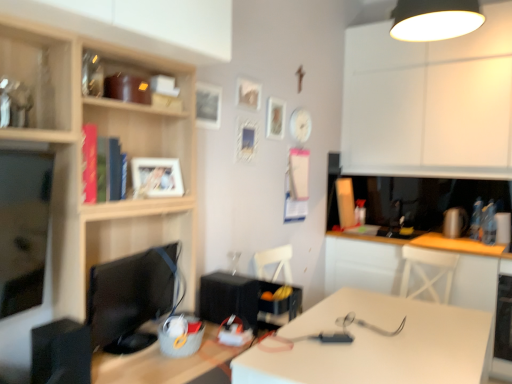
What is the approximate height of white matte desk at center?

white matte desk at center is 25.80 inches tall.

In order to face black glossy monitor at left, should I rotate leftwards or rightwards?

Turn left by 14.703 degrees to look at black glossy monitor at left.

What is the approximate width of matte wooden picture frame at upper left, which ranks as the first picture frame in left-to-right order?

matte wooden picture frame at upper left, which ranks as the first picture frame in left-to-right order, is 4.18 inches wide.

In order to face matte wooden picture frame at upper left, marked as the fifth picture frame in a right-to-left arrangement, should I rotate leftwards or rightwards?

To face it directly, rotate left by 13.085 degrees.

Where is `black plastic speaker at left, the 1th appliance viewed from the left`? Image resolution: width=512 pixels, height=384 pixels. black plastic speaker at left, the 1th appliance viewed from the left is located at coordinates (61, 353).

Measure the distance between wooden photo frame at upper center, the 2th picture frame positioned from the left, and camera.

wooden photo frame at upper center, the 2th picture frame positioned from the left, is 2.18 meters away from camera.

Locate an element on the screen. The width and height of the screenshot is (512, 384). white matte desk at center is located at coordinates (376, 344).

Which of these two, white matte cabinet at upper right, placed as the second cabinetry when sorted from left to right, or black plastic speaker at left, the 1th appliance viewed from the left, is bigger?

With larger size is white matte cabinet at upper right, placed as the second cabinetry when sorted from left to right.

Based on the photo, are white matte cabinet at upper right, marked as the second cabinetry in a front-to-back arrangement, and black plastic speaker at left, which ranks as the second appliance in back-to-front order, located far from each other?

Yes, white matte cabinet at upper right, marked as the second cabinetry in a front-to-back arrangement, is far from black plastic speaker at left, which ranks as the second appliance in back-to-front order.

Starting from the white matte cabinet at upper right, marked as the second cabinetry in a front-to-back arrangement, which appliance is the 2nd one in front? Please provide its 2D coordinates.

[(61, 353)]

From a real-world perspective, which object rests below the other?

black plastic speaker at left, arranged as the first appliance when viewed from the front, is physically lower.

From a real-world perspective, which object rests below the other?

matte wooden picture frame at upper left, marked as the fifth picture frame in a right-to-left arrangement, from a real-world perspective.

Which is less distant, (176, 180) or (259, 88)?

Point (176, 180) is positioned closer to the camera compared to point (259, 88).

Consider the image. Is matte wooden picture frame at upper left, which appears as the first picture frame when viewed from the front, directly adjacent to white matte picture frame at upper center, the 4th picture frame viewed from the left?

matte wooden picture frame at upper left, which appears as the first picture frame when viewed from the front, and white matte picture frame at upper center, the 4th picture frame viewed from the left, are clearly separated.

Considering the relative positions of matte wooden picture frame at upper left, which appears as the first picture frame when viewed from the front, and white matte picture frame at upper center, arranged as the third picture frame when viewed from the front, in the image provided, is matte wooden picture frame at upper left, which appears as the first picture frame when viewed from the front, to the right of white matte picture frame at upper center, arranged as the third picture frame when viewed from the front, from the viewer's perspective?

In fact, matte wooden picture frame at upper left, which appears as the first picture frame when viewed from the front, is to the left of white matte picture frame at upper center, arranged as the third picture frame when viewed from the front.

The width and height of the screenshot is (512, 384). In order to click on cabinetry that appears in front of the white glossy picture frame at upper center, which appears as the 3th picture frame when viewed from the left in this screenshot , I will do `click(81, 167)`.

From a real-world perspective, does white glossy picture frame at upper center, which is the third picture frame from right to left, sit lower than matte wood cabinet at left, which is the 1th cabinetry from front to back?

No, from a real-world perspective, white glossy picture frame at upper center, which is the third picture frame from right to left, is not below matte wood cabinet at left, which is the 1th cabinetry from front to back.

Considering the relative sizes of white glossy table at lower right and white glossy picture frame at upper center, which is the third picture frame from right to left, in the image provided, is white glossy table at lower right smaller than white glossy picture frame at upper center, which is the third picture frame from right to left,?

Incorrect, white glossy table at lower right is not smaller in size than white glossy picture frame at upper center, which is the third picture frame from right to left.

From a real-world perspective, is white glossy table at lower right positioned above or below white glossy picture frame at upper center, which is the third picture frame from right to left?

From a real-world perspective, white glossy table at lower right is physically below white glossy picture frame at upper center, which is the third picture frame from right to left.

How different are the orientations of white glossy table at lower right and white glossy picture frame at upper center, which appears as the second picture frame when viewed from the back, in degrees?

89.6 degrees.

Looking at this image, considering the relative positions of white glossy table at lower right and white glossy picture frame at upper center, which appears as the 3th picture frame when viewed from the left, in the image provided, is white glossy table at lower right behind white glossy picture frame at upper center, which appears as the 3th picture frame when viewed from the left,?

Yes, it is behind white glossy picture frame at upper center, which appears as the 3th picture frame when viewed from the left.

Does point (254, 87) come in front of point (137, 309)?

No.

Can you confirm if white matte picture frame at upper center, arranged as the third picture frame when viewed from the front, is positioned to the left of black glossy monitor at left?

Incorrect, white matte picture frame at upper center, arranged as the third picture frame when viewed from the front, is not on the left side of black glossy monitor at left.

Is white matte picture frame at upper center, the 4th picture frame viewed from the left, positioned with its back to black glossy monitor at left?

No, black glossy monitor at left is not at the back of white matte picture frame at upper center, the 4th picture frame viewed from the left.

From their relative heights in the image, would you say white matte picture frame at upper center, which appears as the 3th picture frame when viewed from the back, is taller or shorter than black glossy monitor at left?

Clearly, white matte picture frame at upper center, which appears as the 3th picture frame when viewed from the back, is shorter compared to black glossy monitor at left.

Is white matte desk at center bigger than white matte picture frame at upper center, placed as the second picture frame when sorted from right to left?

Yes.

Is white matte desk at center not within white matte picture frame at upper center, arranged as the third picture frame when viewed from the front?

white matte desk at center is positioned outside white matte picture frame at upper center, arranged as the third picture frame when viewed from the front.

Which object is more forward, white matte desk at center or white matte picture frame at upper center, arranged as the third picture frame when viewed from the front?

white matte desk at center is in front.

Is white matte desk at center beside white matte picture frame at upper center, the 4th picture frame viewed from the left?

No, white matte desk at center is not making contact with white matte picture frame at upper center, the 4th picture frame viewed from the left.

Considering their positions, is white matte desk at center located in front of or behind black plastic speaker at left, the 1th appliance viewed from the left?

white matte desk at center is positioned closer to the viewer than black plastic speaker at left, the 1th appliance viewed from the left.

Is point (292, 332) farther from viewer compared to point (62, 372)?

Yes, it is.

Is white matte desk at center not inside black plastic speaker at left, which is counted as the second appliance, starting from the right?

white matte desk at center lies outside black plastic speaker at left, which is counted as the second appliance, starting from the right,'s area.

Considering the sizes of objects white matte desk at center and black plastic speaker at left, arranged as the first appliance when viewed from the front, in the image provided, who is bigger, white matte desk at center or black plastic speaker at left, arranged as the first appliance when viewed from the front,?

→ white matte desk at center is bigger.

Where is `the 2nd appliance in front when counting from the white matte cabinet at upper right, the first cabinetry when ordered from right to left`? the 2nd appliance in front when counting from the white matte cabinet at upper right, the first cabinetry when ordered from right to left is located at coordinates (61, 353).

I want to click on the 3rd picture frame to the right of the matte wooden picture frame at upper left, marked as the fifth picture frame in a right-to-left arrangement, starting your count from the anchor, so click(248, 94).

When comparing their distances from white matte desk at center, does black plastic speaker at left, which is counted as the second appliance, starting from the right, or black matte speaker at center, marked as the 1th appliance in a right-to-left arrangement, seem further?

Based on the image, black plastic speaker at left, which is counted as the second appliance, starting from the right, appears to be further to white matte desk at center.

Which object lies further to the anchor point wooden picture frame at upper center, the 1th picture frame in the back-to-front sequence, white matte picture frame at upper center, which appears as the 3th picture frame when viewed from the back, or wooden photo frame at upper center, which is the second picture frame in front-to-back order?

wooden photo frame at upper center, which is the second picture frame in front-to-back order, lies further to wooden picture frame at upper center, the 1th picture frame in the back-to-front sequence, than the other object.

Considering their positions, is black glossy monitor at left positioned closer to matte wood cabinet at left, the second cabinetry in the right-to-left sequence, than matte wooden picture frame at upper left, which ranks as the first picture frame in left-to-right order?

matte wooden picture frame at upper left, which ranks as the first picture frame in left-to-right order.

Which object lies nearer to the anchor point white matte picture frame at upper center, arranged as the third picture frame when viewed from the front, wooden picture frame at upper center, the fifth picture frame from the left, or black glossy monitor at left?

wooden picture frame at upper center, the fifth picture frame from the left, is closer to white matte picture frame at upper center, arranged as the third picture frame when viewed from the front.

Based on their spatial positions, is wooden picture frame at upper center, which is counted as the first picture frame, starting from the right, or white matte desk at center closer to white glossy picture frame at upper center, which appears as the 3th picture frame when viewed from the left?

Among the two, wooden picture frame at upper center, which is counted as the first picture frame, starting from the right, is located nearer to white glossy picture frame at upper center, which appears as the 3th picture frame when viewed from the left.

Which object lies further to the anchor point white matte desk at center, white glossy picture frame at upper center, which appears as the 3th picture frame when viewed from the left, or black plastic speaker at left, arranged as the first appliance when viewed from the front?

white glossy picture frame at upper center, which appears as the 3th picture frame when viewed from the left, is positioned further to the anchor white matte desk at center.

Based on their spatial positions, is white matte picture frame at upper center, the 4th picture frame viewed from the left, or white glossy picture frame at upper center, which is the third picture frame from right to left, further from wooden picture frame at upper center, the 5th picture frame in the front-to-back sequence?

Among the two, white glossy picture frame at upper center, which is the third picture frame from right to left, is located further to wooden picture frame at upper center, the 5th picture frame in the front-to-back sequence.

Which object lies nearer to the anchor point black glossy monitor at left, black plastic speaker at left, arranged as the first appliance when viewed from the front, or wooden picture frame at upper center, the 1th picture frame in the back-to-front sequence?

black plastic speaker at left, arranged as the first appliance when viewed from the front.

The image size is (512, 384). What are the coordinates of `computer desk located between matte wood cabinet at left, which is the 1th cabinetry from front to back, and white matte cabinet at upper right, the first cabinetry when ordered from right to left, in the left-right direction` in the screenshot? It's located at (362, 263).

This screenshot has width=512, height=384. I want to click on appliance between matte wooden picture frame at upper left, marked as the fifth picture frame in a right-to-left arrangement, and black plastic speaker at left, arranged as the first appliance when viewed from the front, vertically, so click(x=229, y=298).

The height and width of the screenshot is (384, 512). I want to click on appliance located between black plastic speaker at left, the 1th appliance viewed from the left, and wooden picture frame at upper center, the 5th picture frame in the front-to-back sequence, in the depth direction, so click(x=229, y=298).

In order to click on computer desk located between white matte desk at center and white matte cabinet at upper right, marked as the second cabinetry in a front-to-back arrangement, in the depth direction in this screenshot , I will do `click(362, 263)`.